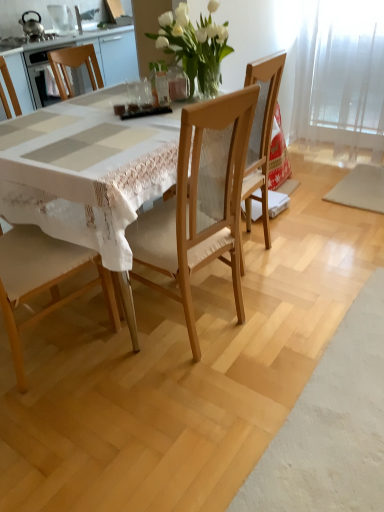
Question: Can you confirm if wooden table at center is taller than white glass vase at upper center?

Choices:
 (A) no
 (B) yes

Answer: (B)

Question: Is the position of wooden table at center less distant than that of white glass vase at upper center?

Choices:
 (A) yes
 (B) no

Answer: (A)

Question: Is wooden table at center facing towards white glass vase at upper center?

Choices:
 (A) no
 (B) yes

Answer: (A)

Question: From a real-world perspective, is wooden table at center beneath white glass vase at upper center?

Choices:
 (A) yes
 (B) no

Answer: (A)

Question: From the image's perspective, is wooden table at center located beneath white glass vase at upper center?

Choices:
 (A) no
 (B) yes

Answer: (B)

Question: Is white glass vase at upper center completely or partially inside wooden table at center?

Choices:
 (A) yes
 (B) no

Answer: (B)

Question: Is wooden chair at center, positioned as the 2th chair in left-to-right order, far from metallic teapot at upper left, which is counted as the 1th appliance, starting from the left?

Choices:
 (A) no
 (B) yes

Answer: (B)

Question: Does wooden chair at center, which is the first chair in right-to-left order, have a greater width compared to metallic teapot at upper left, which is counted as the 1th appliance, starting from the left?

Choices:
 (A) yes
 (B) no

Answer: (A)

Question: Would you say wooden chair at center, positioned as the 2th chair in left-to-right order, is outside metallic teapot at upper left, which is counted as the 1th appliance, starting from the left?

Choices:
 (A) no
 (B) yes

Answer: (B)

Question: Could you tell me if wooden chair at center, which is the first chair in right-to-left order, is turned towards metallic teapot at upper left, which is counted as the 1th appliance, starting from the left?

Choices:
 (A) no
 (B) yes

Answer: (A)

Question: Is wooden chair at center, positioned as the 2th chair in left-to-right order, thinner than metallic teapot at upper left, positioned as the 2th appliance in right-to-left order?

Choices:
 (A) no
 (B) yes

Answer: (A)

Question: Is wooden chair at center, positioned as the 2th chair in left-to-right order, touching metallic teapot at upper left, which is counted as the 1th appliance, starting from the left?

Choices:
 (A) no
 (B) yes

Answer: (A)

Question: From a real-world perspective, is metallic teapot at upper left, positioned as the 2th appliance in right-to-left order, over wooden table at center?

Choices:
 (A) yes
 (B) no

Answer: (A)